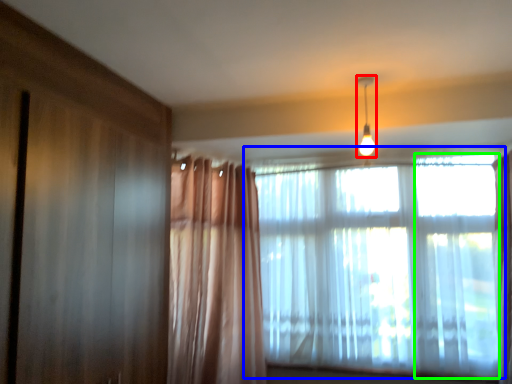
Question: Estimate the real-world distances between objects in this image. Which object is farther from light fixture (highlighted by a red box), window (highlighted by a blue box) or window (highlighted by a green box)?

Choices:
 (A) window
 (B) window

Answer: (B)